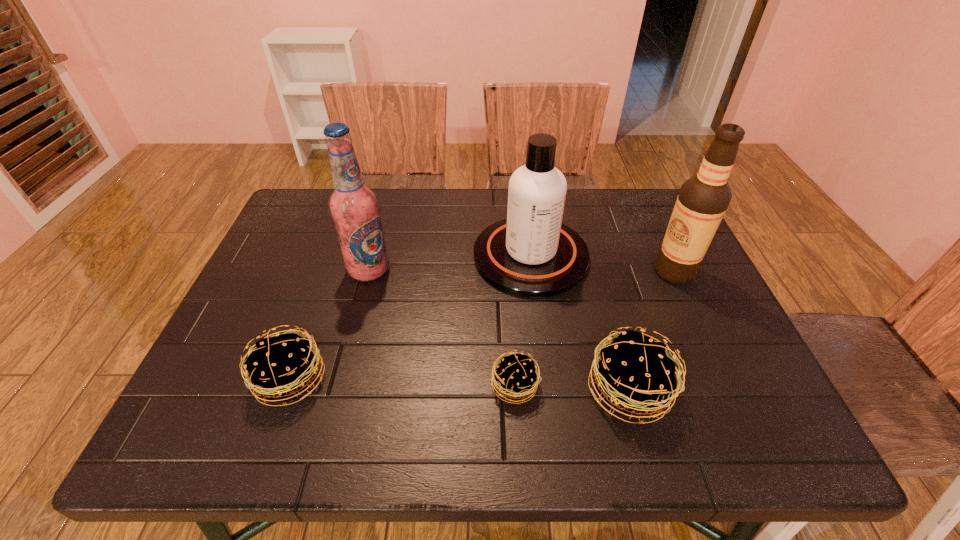
The image size is (960, 540). I want to click on unoccupied position between the rightmost patty and the left alcohol, so click(x=499, y=330).

The width and height of the screenshot is (960, 540). What are the coordinates of `free space that is in between the leftmost patty and the rightmost object` in the screenshot? It's located at (483, 325).

Locate an element on the screen. Image resolution: width=960 pixels, height=540 pixels. unoccupied area between the second patty from right to left and the rightmost object is located at coordinates (594, 328).

This screenshot has width=960, height=540. Identify the location of the second closest object to the left alcohol. (532, 254).

Choose which object is the third nearest neighbor to the third tallest object. Please provide its 2D coordinates. Your answer should be formatted as a tuple, i.e. [(x, y)], where the tuple contains the x and y coordinates of a point satisfying the conditions above.

[(522, 384)]

This screenshot has width=960, height=540. I want to click on patty that stands as the second closest to the rightmost patty, so click(281, 368).

The image size is (960, 540). I want to click on the closest patty to the rightmost patty, so click(522, 384).

Locate an element on the screen. vacant space that satisfies the following two spatial constraints: 1. on the back side of the second shortest patty; 2. on the left side of the left alcohol is located at coordinates (329, 270).

You are a GUI agent. You are given a task and a screenshot of the screen. Output one action in this format:
    pyautogui.click(x=<x>, y=<y>)
    Task: Click on the vacant space that satisfies the following two spatial constraints: 1. on the front side of the second shortest object; 2. on the right side of the second patty from right to left
    The image size is (960, 540).
    Given the screenshot: What is the action you would take?
    pyautogui.click(x=288, y=386)